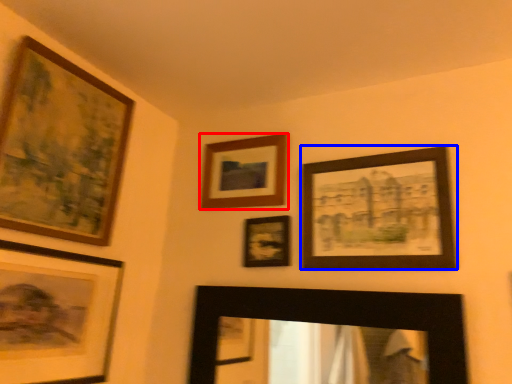
Question: Which of the following is the farthest to the observer, picture frame (highlighted by a red box) or picture frame (highlighted by a blue box)?

Choices:
 (A) picture frame
 (B) picture frame

Answer: (A)